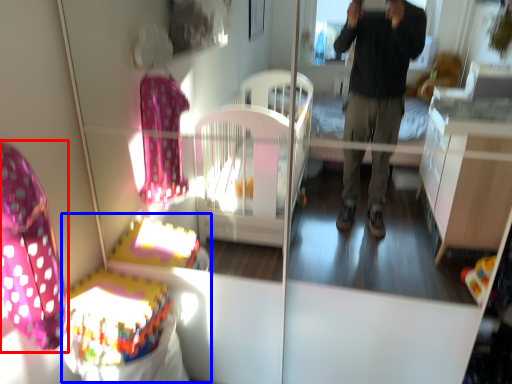
Question: Which object is closer to the camera taking this photo, swivel chair (highlighted by a red box) or baby carriage (highlighted by a blue box)?

Choices:
 (A) swivel chair
 (B) baby carriage

Answer: (A)